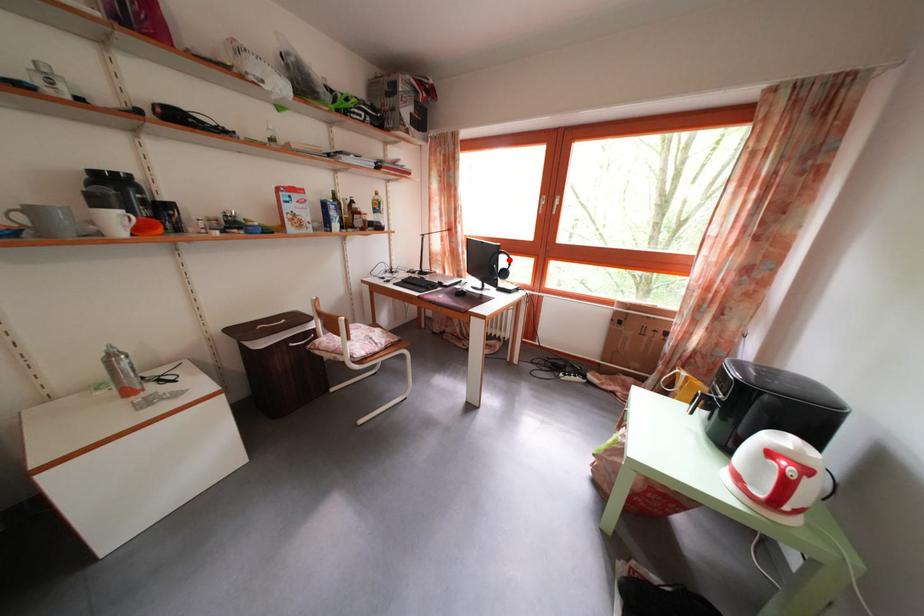
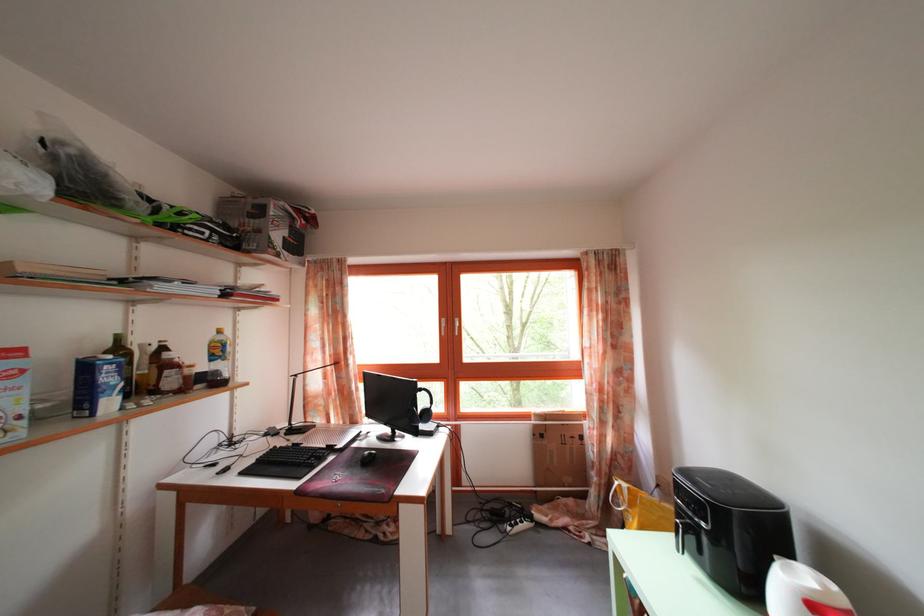
Locate, in the second image, the point that corresponds to the highlighted location in the first image.

(428, 397)